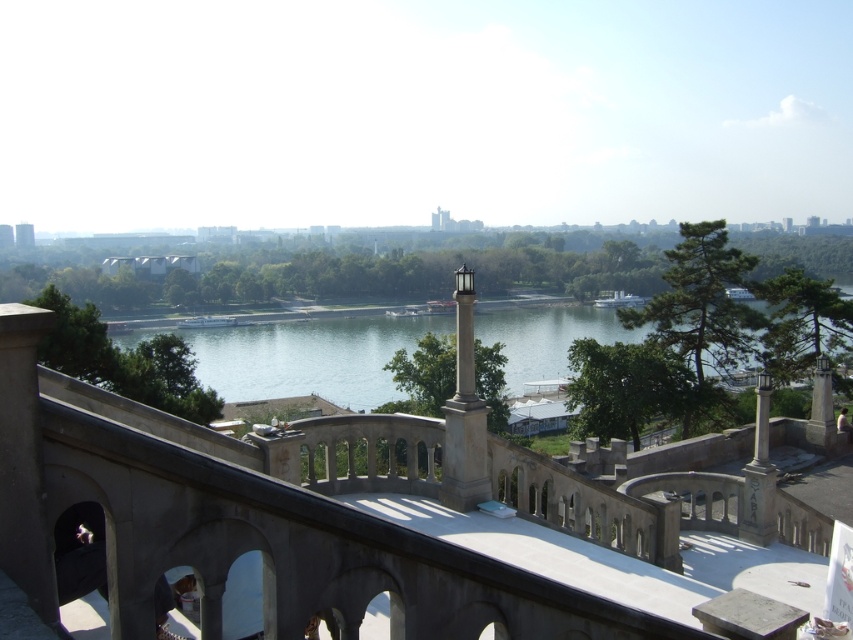
Question: Which of the following is the closest to the observer?

Choices:
 (A) (468, 547)
 (B) (561, 349)
 (C) (474, 458)

Answer: (A)

Question: Does blue water at center have a greater width compared to white stone column at center?

Choices:
 (A) no
 (B) yes

Answer: (B)

Question: Does concrete balcony at center have a lesser width compared to white stone column at center?

Choices:
 (A) yes
 (B) no

Answer: (B)

Question: Does concrete balcony at center appear on the left side of blue water at center?

Choices:
 (A) no
 (B) yes

Answer: (B)

Question: Among these points, which one is nearest to the camera?

Choices:
 (A) (299, 557)
 (B) (213, 369)
 (C) (467, 461)

Answer: (A)

Question: Which is nearer to the blue water at center?

Choices:
 (A) concrete balcony at center
 (B) white stone column at center

Answer: (A)